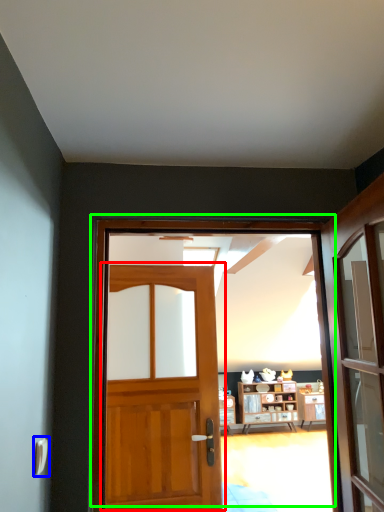
Question: Which object is positioned closest to door (highlighted by a red box)? Select from door handle (highlighted by a blue box) and door (highlighted by a green box).

Choices:
 (A) door handle
 (B) door

Answer: (A)